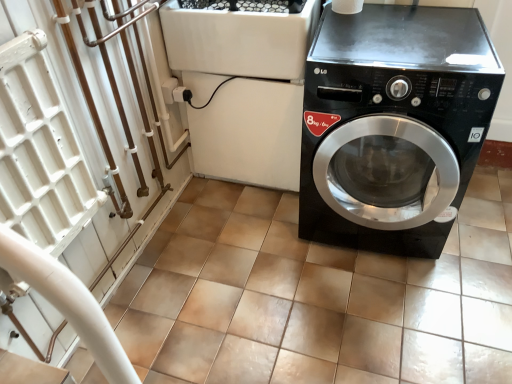
Where is `free point above brown tile at center (from a real-world perspective)`? The image size is (512, 384). free point above brown tile at center (from a real-world perspective) is located at coordinates (315, 292).